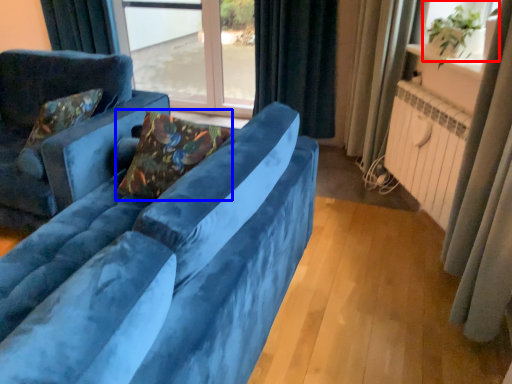
Question: Which object is further to the camera taking this photo, window screen (highlighted by a red box) or pillow (highlighted by a blue box)?

Choices:
 (A) window screen
 (B) pillow

Answer: (A)